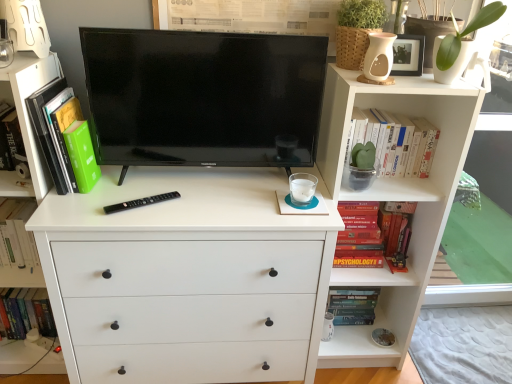
Question: From the image's perspective, does green matte book at left, the 4th book from the right, appear lower than hardcover book at left, which ranks as the fifth book in right-to-left order?

Choices:
 (A) no
 (B) yes

Answer: (A)

Question: Can you confirm if green matte book at left, the second book viewed from the left, is taller than hardcover book at left, which ranks as the fifth book in right-to-left order?

Choices:
 (A) yes
 (B) no

Answer: (A)

Question: Is green matte book at left, the second book viewed from the left, facing away from hardcover book at left, which ranks as the fifth book in right-to-left order?

Choices:
 (A) yes
 (B) no

Answer: (B)

Question: Is green matte book at left, the second book viewed from the left, oriented towards hardcover book at left, the first book viewed from the left?

Choices:
 (A) no
 (B) yes

Answer: (A)

Question: Does green matte book at left, the 4th book from the right, contain hardcover book at left, which ranks as the fifth book in right-to-left order?

Choices:
 (A) yes
 (B) no

Answer: (B)

Question: Can you confirm if green matte book at left, the second book viewed from the left, is shorter than hardcover book at left, which ranks as the fifth book in right-to-left order?

Choices:
 (A) no
 (B) yes

Answer: (A)

Question: Does hardcover book at center-right, which is the 3th book in left-to-right order, have a larger size compared to hardcover psychology book at right, the 2th book from the right?

Choices:
 (A) no
 (B) yes

Answer: (A)

Question: Can you confirm if hardcover book at center-right, the 3th book when ordered from right to left, is taller than hardcover psychology book at right, which is the 4th book from left to right?

Choices:
 (A) no
 (B) yes

Answer: (A)

Question: Does hardcover book at center-right, which is the 3th book in left-to-right order, have a smaller size compared to hardcover psychology book at right, which is the 4th book from left to right?

Choices:
 (A) yes
 (B) no

Answer: (A)

Question: Is the surface of hardcover book at center-right, the 3th book when ordered from right to left, in direct contact with hardcover psychology book at right, the 2th book from the right?

Choices:
 (A) no
 (B) yes

Answer: (A)

Question: Can you confirm if hardcover book at center-right, which is the 3th book in left-to-right order, is wider than hardcover psychology book at right, the 2th book from the right?

Choices:
 (A) no
 (B) yes

Answer: (A)

Question: From the image's perspective, is hardcover book at center-right, which is the 3th book in left-to-right order, beneath hardcover psychology book at right, which is the 4th book from left to right?

Choices:
 (A) no
 (B) yes

Answer: (B)

Question: Does white matte chest of drawers at center have a greater width compared to hardcover book at left, which ranks as the fifth book in right-to-left order?

Choices:
 (A) no
 (B) yes

Answer: (B)